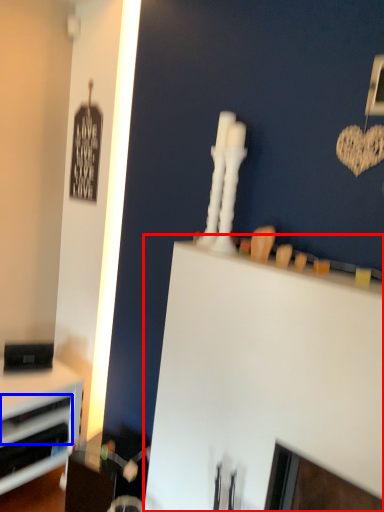
Question: Which object appears closest to the camera in this image, computer desk (highlighted by a red box) or drawer (highlighted by a blue box)?

Choices:
 (A) computer desk
 (B) drawer

Answer: (A)